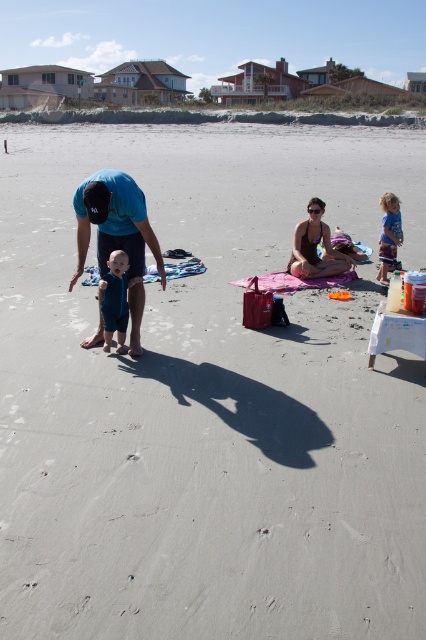
Question: Does pink fabric blanket at center have a lesser width compared to blue woven towel at center?

Choices:
 (A) no
 (B) yes

Answer: (A)

Question: Is blue denim shorts at center wider than pink fabric blanket at center?

Choices:
 (A) yes
 (B) no

Answer: (B)

Question: Estimate the real-world distances between objects in this image. Which object is farther from the blue fabric shirt at center?

Choices:
 (A) pink fabric blanket at center
 (B) blue striped shorts at right
 (C) pink fabric bikini at center
 (D) blue woven towel at center

Answer: (B)

Question: Which point appears closest to the camera in this image?

Choices:
 (A) (118, 282)
 (B) (342, 273)
 (C) (129, 216)

Answer: (C)

Question: Does blue fabric shirt at center appear over blue striped shorts at right?

Choices:
 (A) yes
 (B) no

Answer: (B)

Question: Which point is farther to the camera?

Choices:
 (A) pink fabric blanket at center
 (B) blue striped shorts at right
 (C) blue denim shorts at center

Answer: (B)